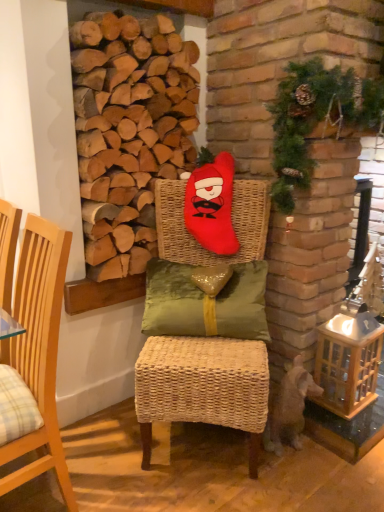
Question: Is green textured wreath at upper right to the left or to the right of matte red plush at center, which is the 1th chair from right to left, in the image?

Choices:
 (A) right
 (B) left

Answer: (A)

Question: Considering the positions of green textured wreath at upper right and matte red plush at center, the second chair from the left, in the image, is green textured wreath at upper right bigger or smaller than matte red plush at center, the second chair from the left,?

Choices:
 (A) big
 (B) small

Answer: (B)

Question: Which of these objects is positioned closest to the green textured wreath at upper right?

Choices:
 (A) wooden lantern at lower right
 (B) brown furry dog at lower right
 (C) matte red plush at center, the second chair from the left
 (D) green satin pillow at center
 (E) red plush santa at center

Answer: (E)

Question: Estimate the real-world distances between objects in this image. Which object is farther from the red plush santa at center?

Choices:
 (A) wooden lantern at lower right
 (B) green satin pillow at center
 (C) matte red plush at center, which is the 1th chair from right to left
 (D) green textured wreath at upper right
 (E) brown furry dog at lower right

Answer: (E)